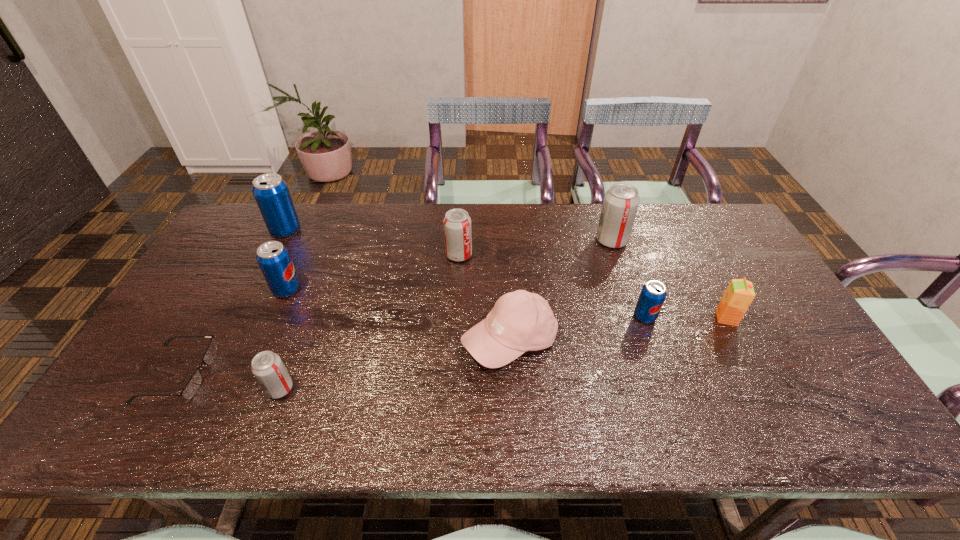
In the image, there is a desktop. Identify the location of free space at the far left corner. This screenshot has height=540, width=960. (248, 216).

Identify the location of vacant region at the near left corner of the desktop. The height and width of the screenshot is (540, 960). (156, 438).

You are a GUI agent. You are given a task and a screenshot of the screen. Output one action in this format:
    pyautogui.click(x=<x>, y=<y>)
    Task: Click on the free space between the spectacles and the farthest blue pop soda
    
    Given the screenshot: What is the action you would take?
    pyautogui.click(x=231, y=302)

Locate an element on the screen. This screenshot has width=960, height=540. vacant area that lies between the rightmost object and the biggest blue pop soda is located at coordinates (506, 274).

Find the location of a particular element. free space that is in between the farthest blue pop soda and the rightmost blue pop soda is located at coordinates (465, 273).

Image resolution: width=960 pixels, height=540 pixels. Find the location of `vacant area that lies between the sixth nearest object and the fourth soda can from right to left`. vacant area that lies between the sixth nearest object and the fourth soda can from right to left is located at coordinates (283, 339).

You are a GUI agent. You are given a task and a screenshot of the screen. Output one action in this format:
    pyautogui.click(x=<x>, y=<y>)
    Task: Click on the free point between the fourth soda can from right to left and the fourth farthest soda can
    Image resolution: width=960 pixels, height=540 pixels.
    Given the screenshot: What is the action you would take?
    pyautogui.click(x=283, y=339)

Locate an element on the screen. free space between the biggest blue pop soda and the shortest object is located at coordinates (231, 302).

What are the coordinates of `free space between the orange juice and the baseball cap` in the screenshot? It's located at (618, 329).

Where is `unoccupied area between the black spectacles and the orange juice`? This screenshot has width=960, height=540. unoccupied area between the black spectacles and the orange juice is located at coordinates (452, 346).